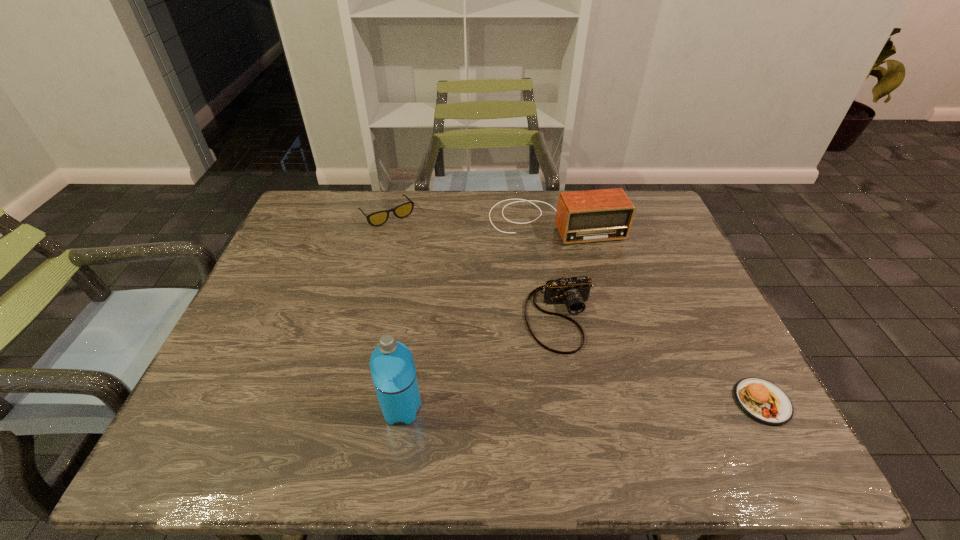
The height and width of the screenshot is (540, 960). Identify the location of patty present at the near edge. (763, 401).

Where is `patty present at the right edge`? Image resolution: width=960 pixels, height=540 pixels. patty present at the right edge is located at coordinates coord(763,401).

You are a GUI agent. You are given a task and a screenshot of the screen. Output one action in this format:
    pyautogui.click(x=<x>, y=<y>)
    Task: Click on the radio receiver that is at the right edge
    The width and height of the screenshot is (960, 540).
    Given the screenshot: What is the action you would take?
    pyautogui.click(x=595, y=215)

Where is `object that is at the far right corner`? The height and width of the screenshot is (540, 960). object that is at the far right corner is located at coordinates (595, 215).

You are a GUI agent. You are given a task and a screenshot of the screen. Output one action in this format:
    pyautogui.click(x=<x>, y=<y>)
    Task: Click on the object that is at the near right corner
    The width and height of the screenshot is (960, 540).
    Given the screenshot: What is the action you would take?
    pyautogui.click(x=763, y=401)

I want to click on blank space at the far edge of the desktop, so click(455, 204).

Image resolution: width=960 pixels, height=540 pixels. What are the coordinates of `vacant space at the near edge of the desktop` in the screenshot? It's located at pyautogui.click(x=684, y=413).

At what (x,y) coordinates should I click in order to perform the action: click on free space at the left edge of the desktop. Please return your answer as a coordinate pair (x, y). The image size is (960, 540). Looking at the image, I should click on (297, 291).

Where is `vacant region at the right edge of the desktop`? The width and height of the screenshot is (960, 540). vacant region at the right edge of the desktop is located at coordinates (717, 312).

This screenshot has width=960, height=540. In the image, there is a desktop. Identify the location of vacant area at the far left corner. (311, 201).